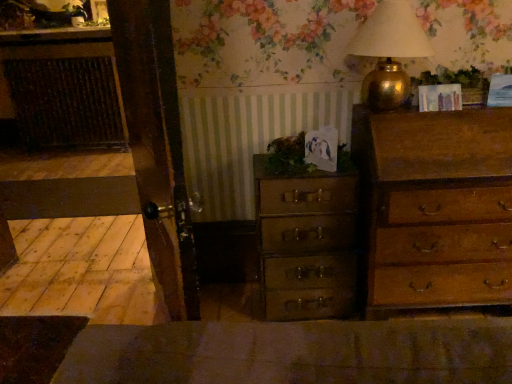
Question: From a real-world perspective, does wooden chest of drawers at center, which is counted as the second chest of drawers, starting from the right, sit lower than green leafy plant at upper right, which is the 1th plant from top to bottom?

Choices:
 (A) no
 (B) yes

Answer: (B)

Question: From a real-world perspective, is wooden chest of drawers at center, which is counted as the second chest of drawers, starting from the right, over green leafy plant at upper right, acting as the second plant starting from the bottom?

Choices:
 (A) yes
 (B) no

Answer: (B)

Question: From the image's perspective, is wooden chest of drawers at center, which is counted as the second chest of drawers, starting from the right, under green leafy plant at upper right, acting as the second plant starting from the bottom?

Choices:
 (A) no
 (B) yes

Answer: (B)

Question: Does wooden chest of drawers at center, which is counted as the second chest of drawers, starting from the right, contain green leafy plant at upper right, which is the 1th plant from top to bottom?

Choices:
 (A) no
 (B) yes

Answer: (A)

Question: Considering the relative sizes of wooden chest of drawers at center, which is counted as the second chest of drawers, starting from the right, and green leafy plant at upper right, which is the 1th plant from top to bottom, in the image provided, is wooden chest of drawers at center, which is counted as the second chest of drawers, starting from the right, bigger than green leafy plant at upper right, which is the 1th plant from top to bottom,?

Choices:
 (A) no
 (B) yes

Answer: (B)

Question: Is wooden chest of drawers at center, which is the first chest of drawers in left-to-right order, smaller than green leafy plant at upper right, acting as the second plant starting from the bottom?

Choices:
 (A) no
 (B) yes

Answer: (A)

Question: Considering the relative sizes of green leafy plant at center, which is the second plant from top to bottom, and wooden chest of drawers at right, positioned as the 1th chest of drawers in right-to-left order, in the image provided, is green leafy plant at center, which is the second plant from top to bottom, shorter than wooden chest of drawers at right, positioned as the 1th chest of drawers in right-to-left order,?

Choices:
 (A) yes
 (B) no

Answer: (A)

Question: Is green leafy plant at center, which is counted as the 2th plant, starting from the right, taller than wooden chest of drawers at right, positioned as the 1th chest of drawers in right-to-left order?

Choices:
 (A) yes
 (B) no

Answer: (B)

Question: Can you confirm if green leafy plant at center, which is the second plant from top to bottom, is positioned to the left of wooden chest of drawers at right, positioned as the 1th chest of drawers in right-to-left order?

Choices:
 (A) no
 (B) yes

Answer: (B)

Question: Is green leafy plant at center, the first plant from the bottom, at the right side of wooden chest of drawers at right, positioned as the 1th chest of drawers in right-to-left order?

Choices:
 (A) no
 (B) yes

Answer: (A)

Question: Is green leafy plant at center, which is counted as the 2th plant, starting from the right, looking in the opposite direction of wooden chest of drawers at right, positioned as the 1th chest of drawers in right-to-left order?

Choices:
 (A) no
 (B) yes

Answer: (A)

Question: From the image's perspective, is green leafy plant at center, the first plant from the bottom, under wooden chest of drawers at right, the second chest of drawers positioned from the left?

Choices:
 (A) yes
 (B) no

Answer: (B)

Question: Does wooden chest of drawers at right, positioned as the 1th chest of drawers in right-to-left order, have a larger size compared to wooden chest of drawers at center, which is the first chest of drawers in left-to-right order?

Choices:
 (A) yes
 (B) no

Answer: (A)